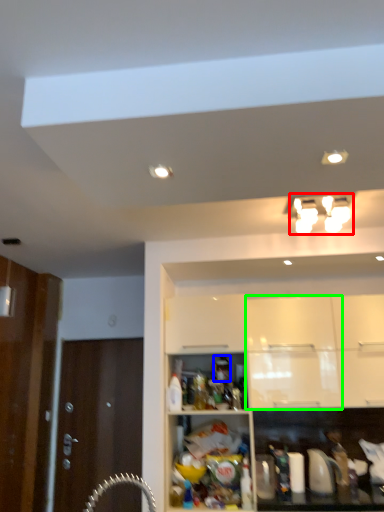
Question: Which is nearer to the light fixture (highlighted by a red box)? beverage (highlighted by a blue box) or cabinetry (highlighted by a green box).

Choices:
 (A) beverage
 (B) cabinetry

Answer: (B)